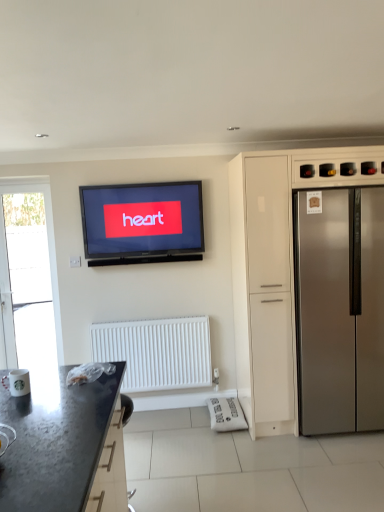
Question: From a real-world perspective, is stainless steel refrigerator at right located higher than matte black television at upper center?

Choices:
 (A) no
 (B) yes

Answer: (A)

Question: Does stainless steel refrigerator at right turn towards matte black television at upper center?

Choices:
 (A) yes
 (B) no

Answer: (B)

Question: From the image's perspective, is stainless steel refrigerator at right located beneath matte black television at upper center?

Choices:
 (A) no
 (B) yes

Answer: (B)

Question: Considering the relative sizes of stainless steel refrigerator at right and matte black television at upper center in the image provided, is stainless steel refrigerator at right taller than matte black television at upper center?

Choices:
 (A) yes
 (B) no

Answer: (A)

Question: Is stainless steel refrigerator at right oriented away from matte black television at upper center?

Choices:
 (A) no
 (B) yes

Answer: (A)

Question: Does stainless steel refrigerator at right have a lesser width compared to matte black television at upper center?

Choices:
 (A) no
 (B) yes

Answer: (A)

Question: From a real-world perspective, is satin silver refrigerator at right on top of black granite countertop at lower left?

Choices:
 (A) yes
 (B) no

Answer: (A)

Question: Considering the relative sizes of satin silver refrigerator at right and black granite countertop at lower left in the image provided, is satin silver refrigerator at right wider than black granite countertop at lower left?

Choices:
 (A) no
 (B) yes

Answer: (A)

Question: Is the depth of satin silver refrigerator at right less than that of black granite countertop at lower left?

Choices:
 (A) no
 (B) yes

Answer: (A)

Question: Is satin silver refrigerator at right thinner than black granite countertop at lower left?

Choices:
 (A) no
 (B) yes

Answer: (B)

Question: Considering the relative positions of satin silver refrigerator at right and black granite countertop at lower left in the image provided, is satin silver refrigerator at right behind black granite countertop at lower left?

Choices:
 (A) yes
 (B) no

Answer: (A)

Question: Is satin silver refrigerator at right to the left of black granite countertop at lower left from the viewer's perspective?

Choices:
 (A) no
 (B) yes

Answer: (A)

Question: Would you say satin silver refrigerator at right is part of black granite countertop at lower left's contents?

Choices:
 (A) no
 (B) yes

Answer: (A)